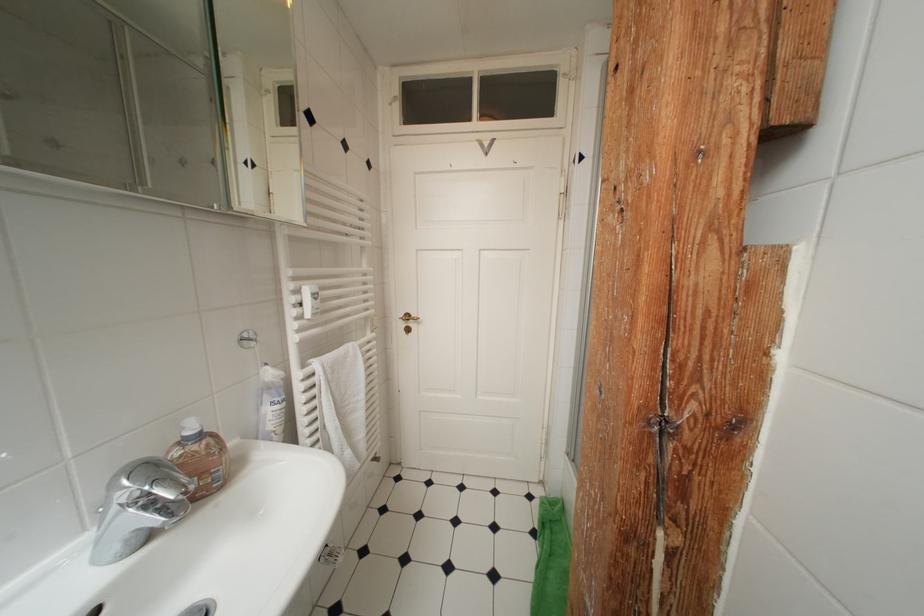
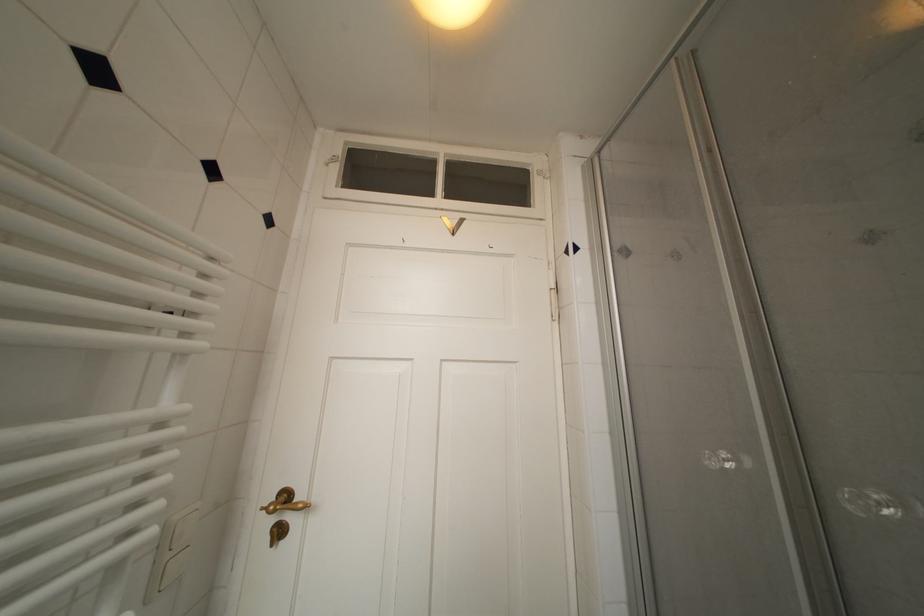
Question: What movement of the cameraman would produce the second image?

Choices:
 (A) Left
 (B) Right
 (C) Forward
 (D) Backward

Answer: (C)